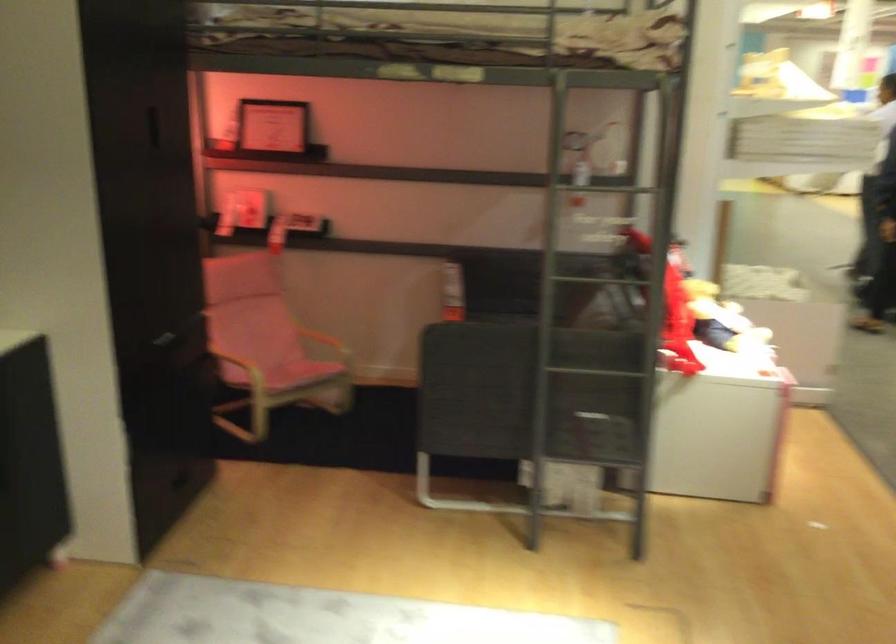
What do you see at coordinates (168, 337) in the screenshot?
I see `a cabinet slot handle` at bounding box center [168, 337].